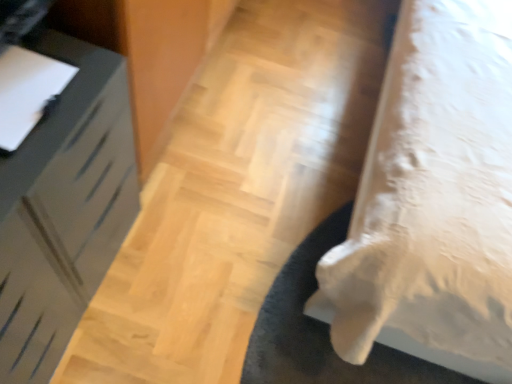
Question: From a real-world perspective, is white glossy drawer at left, which ranks as the 2th furniture in right-to-left order, above or below white fabric bed at lower right, the second furniture positioned from the left?

Choices:
 (A) above
 (B) below

Answer: (B)

Question: From the image's perspective, is white glossy drawer at left, the 1th furniture viewed from the left, located above or below white fabric bed at lower right, arranged as the first furniture when viewed from the right?

Choices:
 (A) below
 (B) above

Answer: (A)

Question: Estimate the real-world distances between objects in this image. Which object is closer to the white glossy drawer at left, the 1th furniture viewed from the left?

Choices:
 (A) white fabric bed at lower right, the second furniture positioned from the left
 (B) black fuzzy mat at lower right

Answer: (B)

Question: Considering the real-world distances, which object is closest to the white glossy drawer at left, which ranks as the 2th furniture in right-to-left order?

Choices:
 (A) white fabric bed at lower right, the second furniture positioned from the left
 (B) black fuzzy mat at lower right

Answer: (B)